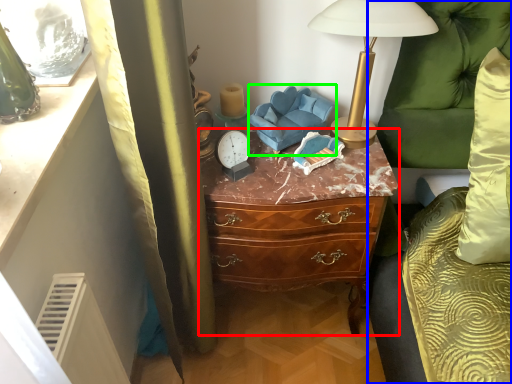
Question: Which object is positioned closest to chest of drawers (highlighted by a red box)? Select from couch (highlighted by a blue box) and swivel chair (highlighted by a green box).

Choices:
 (A) couch
 (B) swivel chair

Answer: (B)